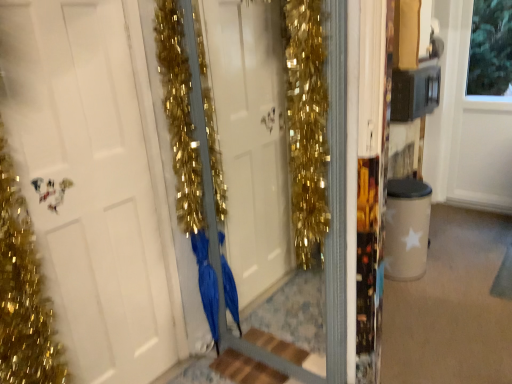
Question: Considering the relative positions of wooden at center and blue satin dress at center in the image provided, is wooden at center to the left or to the right of blue satin dress at center?

Choices:
 (A) left
 (B) right

Answer: (B)

Question: From the image's perspective, is wooden at center located above or below blue satin dress at center?

Choices:
 (A) above
 (B) below

Answer: (B)

Question: Estimate the real-world distances between objects in this image. Which object is closer to the blue satin dress at center?

Choices:
 (A) white matte door at center
 (B) wooden at center

Answer: (B)

Question: Which object is positioned closest to the blue satin dress at center?

Choices:
 (A) wooden at center
 (B) white matte door at center

Answer: (A)